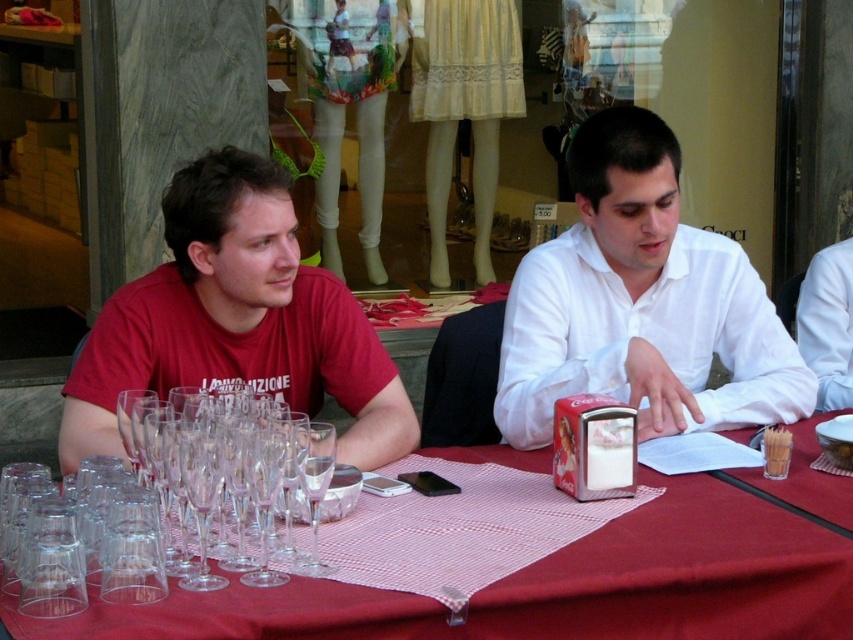
You are standing at the entrance of the outdoor cafe and see the two people seated at the table with the red tablecloth. The person on the left is wearing a red T shirt with white text. Where is the point located at coordinates point (236,321) in relation to the people?

The point (236,321) corresponds to the matte red t shirt at left, which is worn by the person on the left side of the table.

You are standing at the outdoor cafe table and want to place a small item between the two points labeled point (732, 472) and point (305, 445). Which point is closer to you so that the item can be placed in front of it?

Point (305, 445) is closer to you, so placing the item in front of it would position it nearer to your viewpoint compared to point (732, 472).